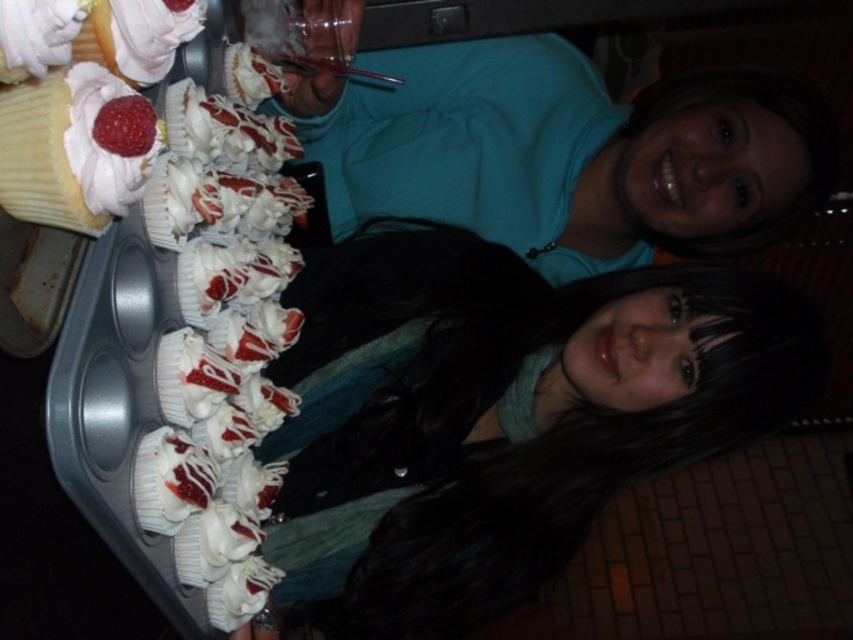
Between matte white cupcakes at lower left and white glossy icing at upper left, which one appears on the left side from the viewer's perspective?

white glossy icing at upper left is more to the left.

Does matte white cupcakes at lower left have a lesser width compared to white glossy icing at upper left?

No, matte white cupcakes at lower left is not thinner than white glossy icing at upper left.

Does point (566, 420) come farther from viewer compared to point (18, 22)?

Yes, it is.

Where is `matte white cupcakes at lower left`? This screenshot has height=640, width=853. matte white cupcakes at lower left is located at coordinates (503, 397).

Can you confirm if white glossy frosting at center is positioned to the left of white glossy icing at upper left?

Incorrect, white glossy frosting at center is not on the left side of white glossy icing at upper left.

Does point (151, 152) lie behind point (74, 19)?

Yes.

Identify the location of white glossy frosting at center. (109, 138).

Which is behind, point (218, 580) or point (67, 83)?

The point (218, 580) is more distant.

Can you confirm if white glossy cupcakes at left is positioned to the right of white glossy frosting at center?

No, white glossy cupcakes at left is not to the right of white glossy frosting at center.

I want to click on white glossy cupcakes at left, so click(219, 340).